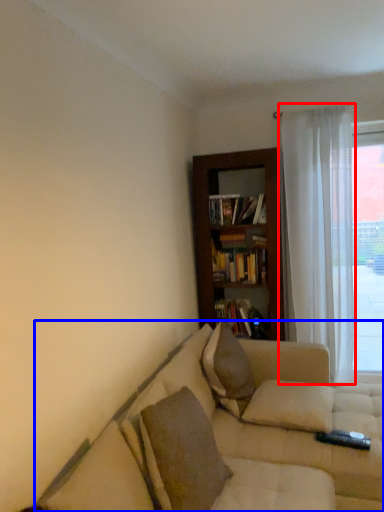
Question: Among these objects, which one is nearest to the camera, curtain (highlighted by a red box) or studio couch (highlighted by a blue box)?

Choices:
 (A) curtain
 (B) studio couch

Answer: (B)